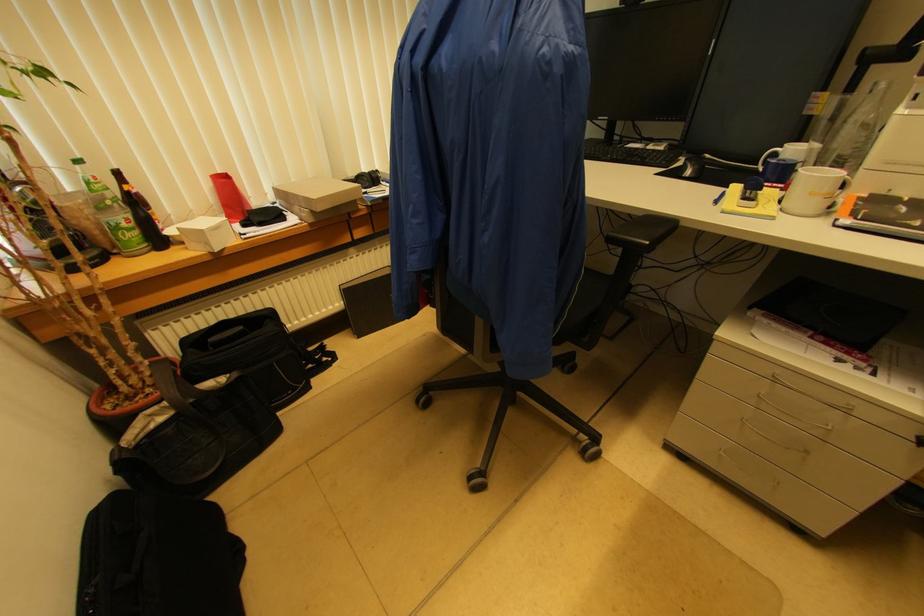
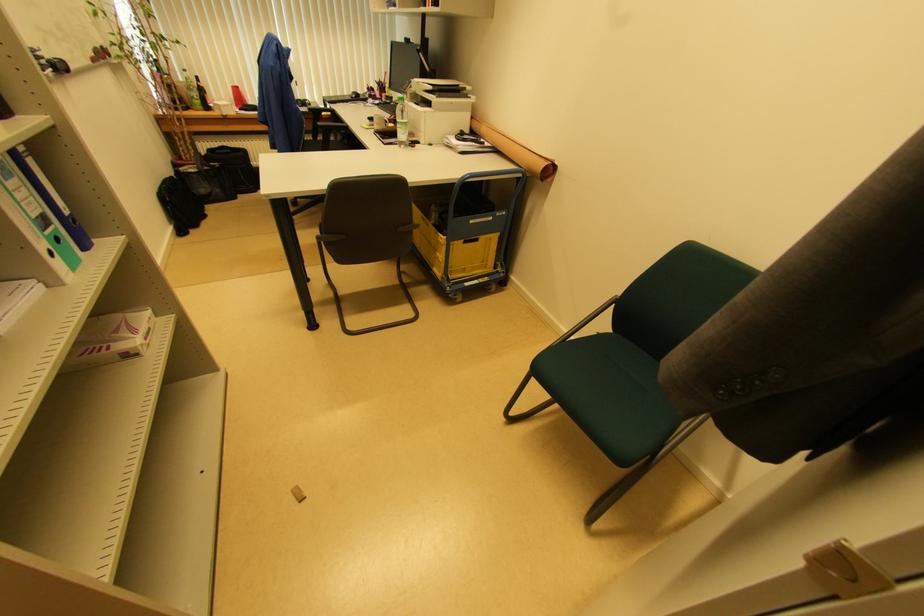
The point at (131, 219) is marked in the first image. Where is the corresponding point in the second image?

(200, 98)